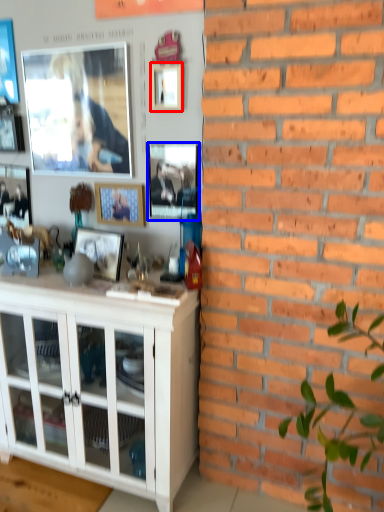
Question: Which object appears farthest to the camera in this image, picture frame (highlighted by a red box) or picture frame (highlighted by a blue box)?

Choices:
 (A) picture frame
 (B) picture frame

Answer: (B)